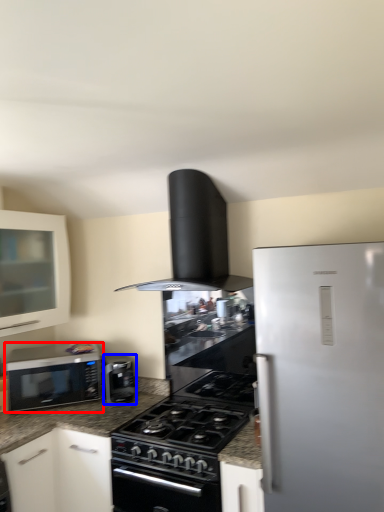
Question: Which of the following is the farthest to the observer, microwave oven (highlighted by a red box) or kitchen appliance (highlighted by a blue box)?

Choices:
 (A) microwave oven
 (B) kitchen appliance

Answer: (B)